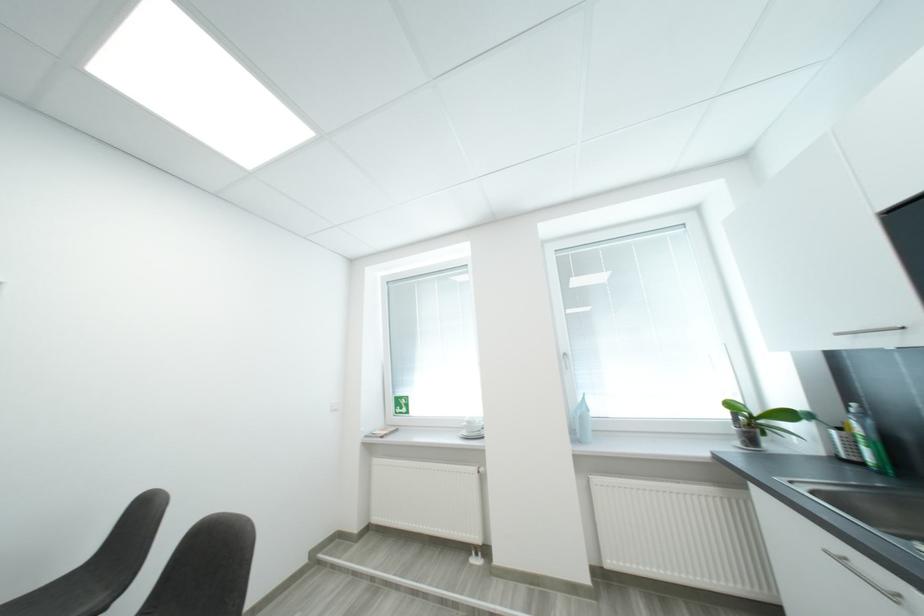
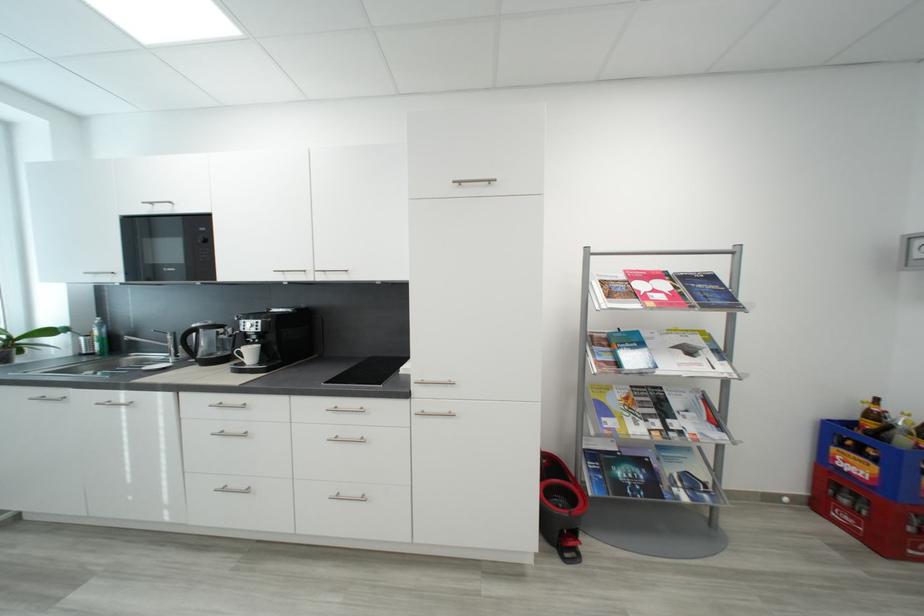
In the second image, find the point that corresponds to (869,467) in the first image.

(100, 355)